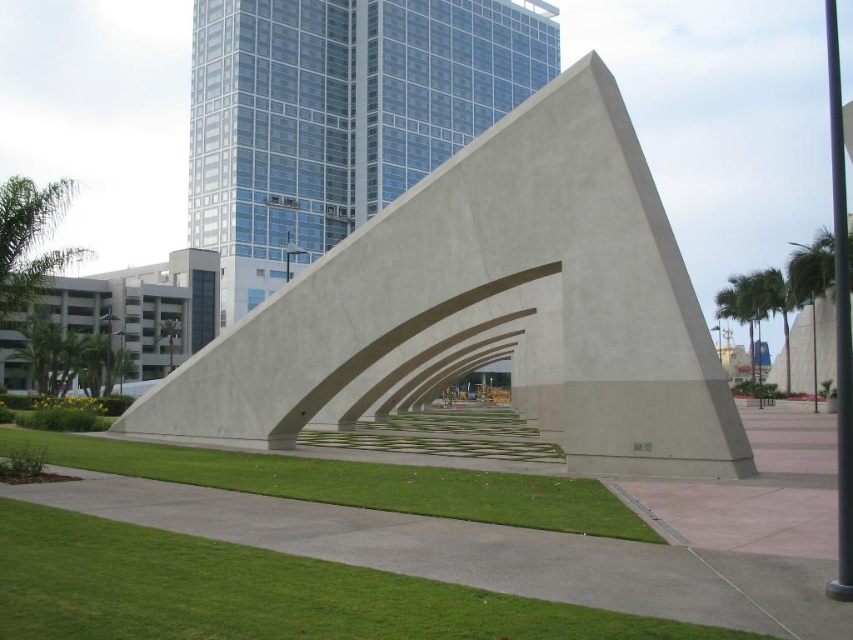
In the scene shown: Which is more to the right, green grass at lower left or green grass at center?

green grass at lower left

Can you confirm if green grass at lower left is positioned to the left of green grass at center?

In fact, green grass at lower left is to the right of green grass at center.

The image size is (853, 640). What do you see at coordinates (256, 593) in the screenshot?
I see `green grass at lower left` at bounding box center [256, 593].

The width and height of the screenshot is (853, 640). I want to click on green grass at lower left, so click(x=256, y=593).

Between smooth concrete sculpture at center and green grass at center, which one is positioned lower?

green grass at center is below.

Is smooth concrete sculpture at center shorter than green grass at center?

No, smooth concrete sculpture at center is not shorter than green grass at center.

The width and height of the screenshot is (853, 640). I want to click on smooth concrete sculpture at center, so click(x=491, y=294).

Is smooth concrete sculpture at center taller than green grass at lower left?

Indeed, smooth concrete sculpture at center has a greater height compared to green grass at lower left.

Between point (337, 275) and point (120, 602), which one is positioned behind?

The point (337, 275) is more distant.

Is point (346, 260) in front of point (424, 630)?

No, it is not.

This screenshot has width=853, height=640. What are the coordinates of `smooth concrete sculpture at center` in the screenshot? It's located at (491, 294).